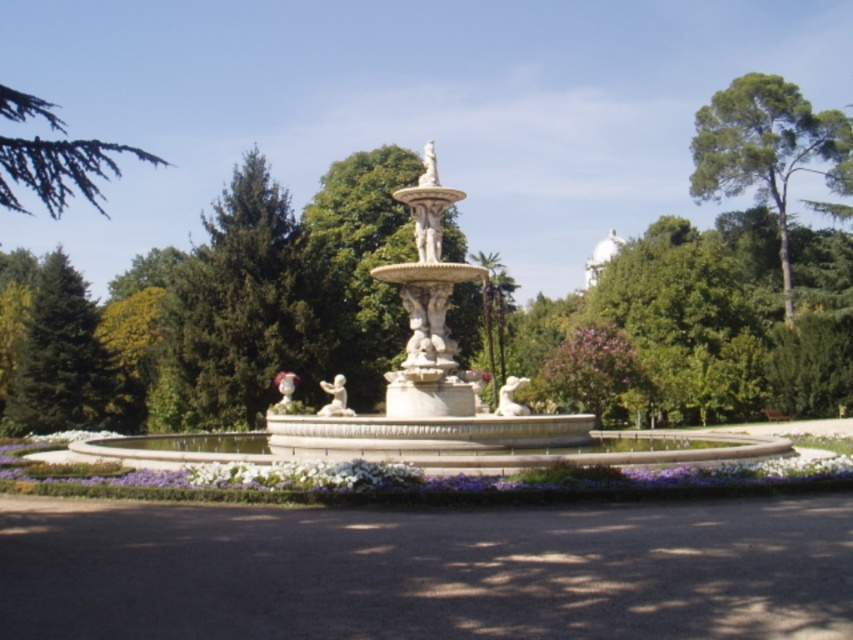
You are a park visitor who wants to take a photo of the fountain. You notice two green trees in the background. Which tree, the green textured tree at upper left or the green fir tree at left, would appear taller in your photo?

The green textured tree at upper left appears taller than the green fir tree at left in the photo because it has a greater height compared to the green fir tree at left.

You are planning to take a photo of the white stone fountain at center and the green fir tree at left. Which object should be placed closer to the camera to ensure both are in focus?

The white stone fountain at center is larger than the green fir tree at left. To ensure both are in focus, place the smaller green fir tree at left closer to the camera.